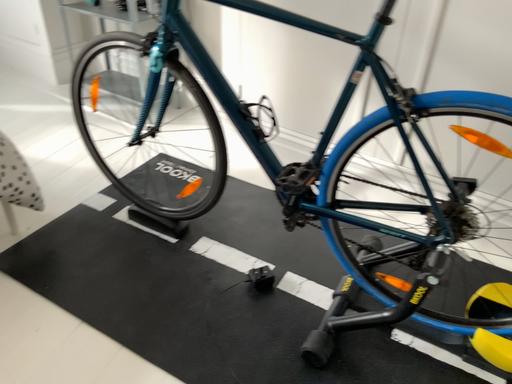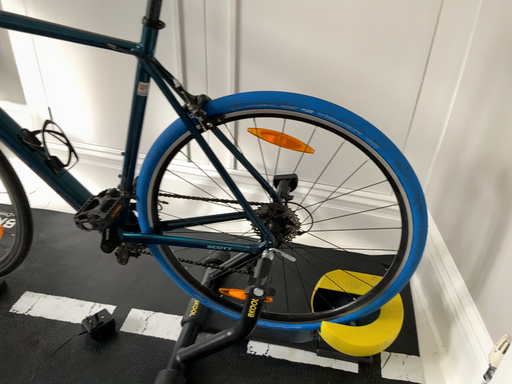
Question: Which way did the camera rotate in the video?

Choices:
 (A) rotated left
 (B) rotated right

Answer: (B)